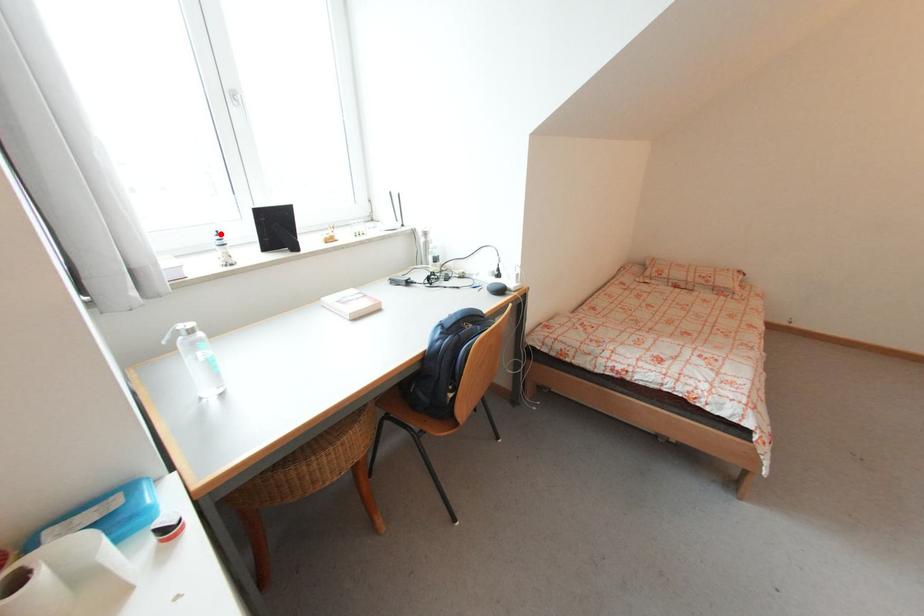
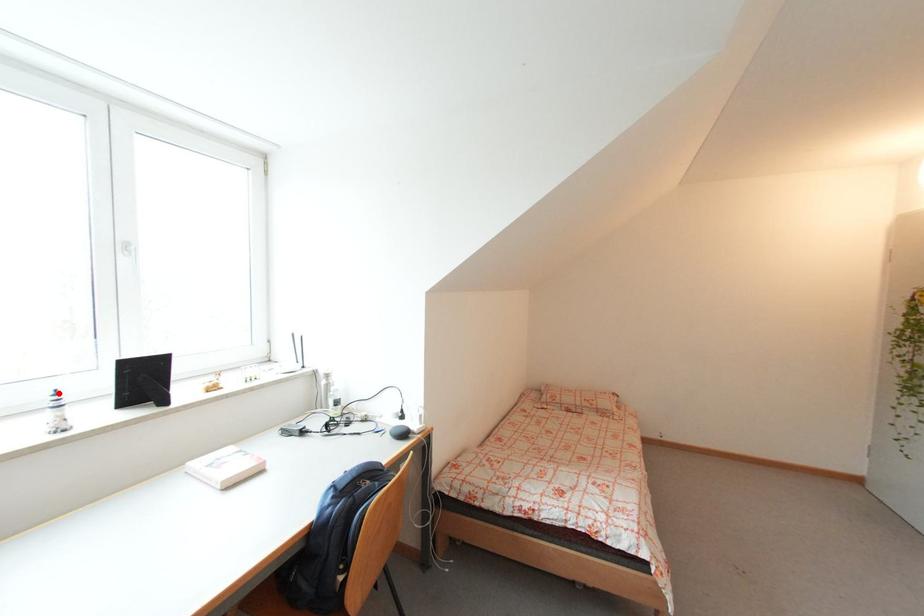
I am providing you with two images of the same scene from different viewpoints. A red point is marked on the first image and another point is marked on the second image. Is the marked point in image1 the same physical position as the marked point in image2?

Yes